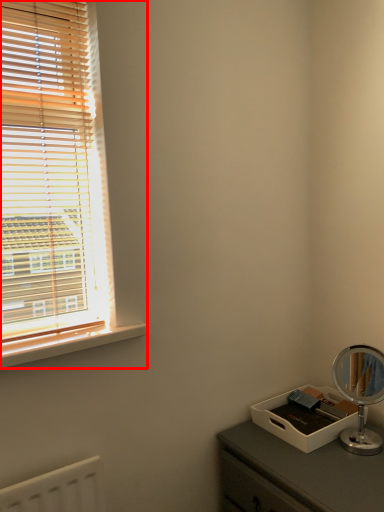
Question: In this image, where is window (annotated by the red box) located relative to window sill?

Choices:
 (A) left
 (B) right

Answer: (A)